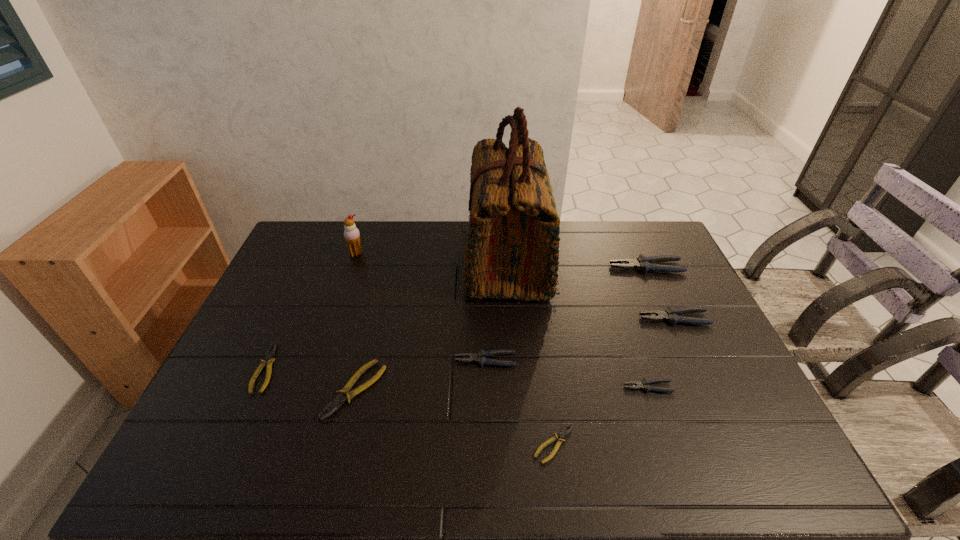
This screenshot has width=960, height=540. What are the coordinates of `vacant space located 0.110m at the gripping part of the nearest gray pliers` in the screenshot? It's located at (582, 387).

Find the location of a particular element. Image resolution: width=960 pixels, height=540 pixels. free space located at the gripping part of the nearest gray pliers is located at coordinates [475, 387].

The image size is (960, 540). Identify the location of vacant space situated 0.080m at the gripping part of the nearest gray pliers. (593, 387).

The image size is (960, 540). In order to click on free space located 0.190m on the back of the leftmost object in this screenshot , I will do `click(298, 299)`.

Find the location of a particular element. vacant space located 0.150m on the right of the shortest pliers is located at coordinates (639, 444).

Locate an element on the screen. Image resolution: width=960 pixels, height=540 pixels. shopping bag located at the far edge is located at coordinates (512, 249).

Locate an element on the screen. The image size is (960, 540). icecream that is at the far edge is located at coordinates (351, 234).

This screenshot has height=540, width=960. I want to click on pliers present at the far edge, so click(x=643, y=263).

The width and height of the screenshot is (960, 540). I want to click on object that is at the near edge, so click(x=563, y=433).

Locate an element on the screen. This screenshot has height=540, width=960. object present at the left edge is located at coordinates (268, 359).